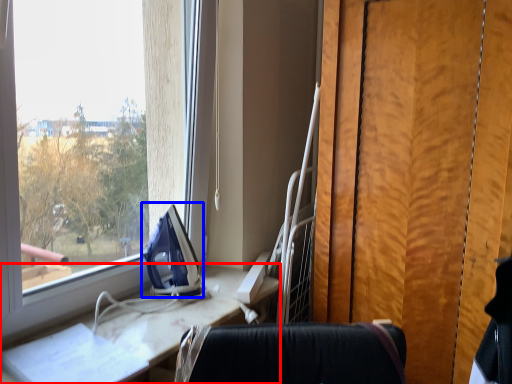
Question: Which object appears closest to the camera in this image, furniture (highlighted by a red box) or equipment (highlighted by a blue box)?

Choices:
 (A) furniture
 (B) equipment

Answer: (A)